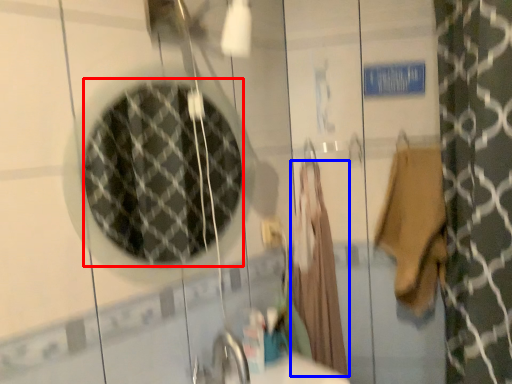
Question: Which object appears closest to the camera in this image, mirror (highlighted by a red box) or robe (highlighted by a blue box)?

Choices:
 (A) mirror
 (B) robe

Answer: (A)